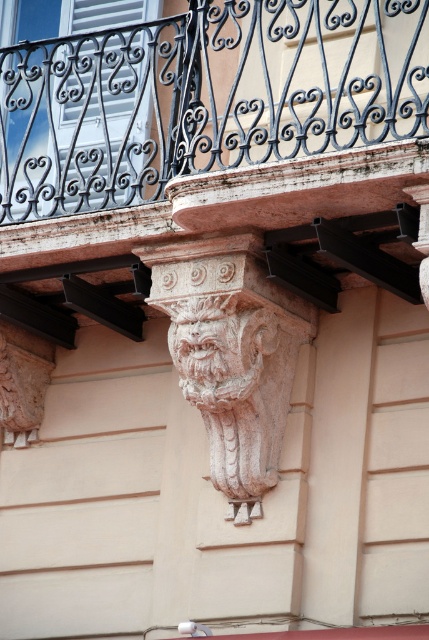
You are standing in front of the building and want to take a photo of the carved stone corbel. If you focus your camera on point (280,1), will point (241,417) also be in focus?

Point (280,1) is closer to the camera than point (241,417). If you focus on the closer point, the farther point may not be in focus depending on the camera settings. To ensure both are sharp, use a smaller aperture for a deeper depth of field.

You are an architect analyzing the building facade. You notice a specific coordinate point on the image. What architectural element is located at point (202, 97)?

The architectural element at point (202, 97) is the rustic stone balcony at center.

You are an architect examining the building facade. You need to install a new light fixture between the rustic stone balcony at center and the carved stone lion at center. Which object should the light fixture be placed closer to, based on their vertical positions?

The rustic stone balcony at center is located above the carved stone lion at center. Therefore, the light fixture should be placed closer to the carved stone lion at center to maintain proper vertical alignment.